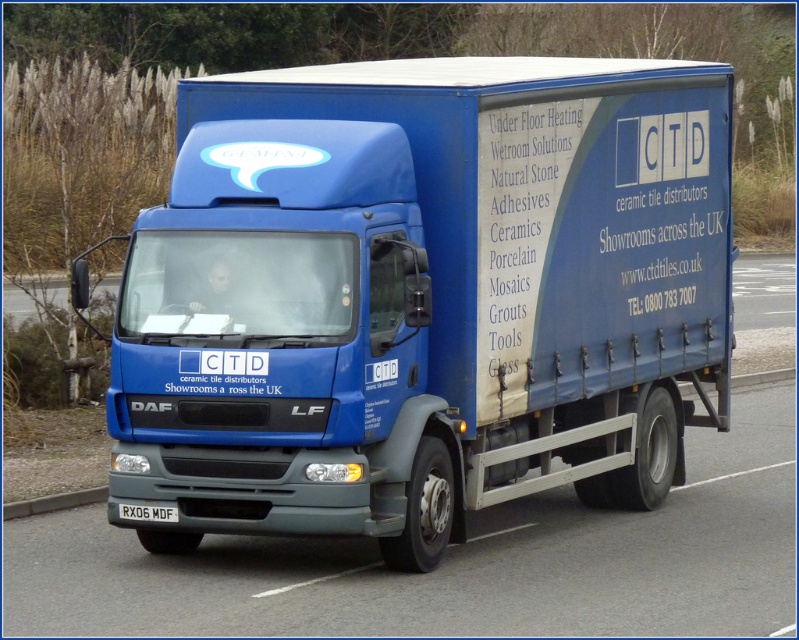
Question: Does matte blue truck at center have a larger size compared to white plastic license plate at bottom?

Choices:
 (A) yes
 (B) no

Answer: (A)

Question: Does matte blue truck at center come in front of white plastic license plate at bottom?

Choices:
 (A) yes
 (B) no

Answer: (B)

Question: Considering the relative positions of matte blue truck at center and white plastic license plate at bottom in the image provided, where is matte blue truck at center located with respect to white plastic license plate at bottom?

Choices:
 (A) below
 (B) above

Answer: (B)

Question: Which object appears farthest from the camera in this image?

Choices:
 (A) matte blue truck at center
 (B) white plastic license plate at bottom

Answer: (A)

Question: Which point appears closest to the camera in this image?

Choices:
 (A) (126, 513)
 (B) (348, 468)

Answer: (B)